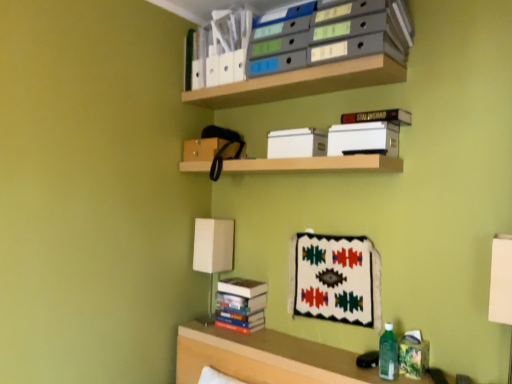
Question: Considering the positions of point (290, 147) and point (240, 56), is point (290, 147) closer or farther from the camera than point (240, 56)?

Choices:
 (A) closer
 (B) farther

Answer: (A)

Question: Is white matte paper at upper center, which is the first paperback book in left-to-right order, wider or thinner than white matte file folder at upper center, which ranks as the second book in bottom-to-top order?

Choices:
 (A) thin
 (B) wide

Answer: (A)

Question: Considering the real-world distances, which object is closest to the hardcover books at lower center, acting as the 2th book starting from the top?

Choices:
 (A) clear wood shelf at lower right, marked as the third shelf in a top-to-bottom arrangement
 (B) white matte file folder at upper center, which ranks as the second book in bottom-to-top order
 (C) wooden shelf at center, the 2th shelf in the bottom-to-top sequence
 (D) white fabric table lamp at left
 (E) hardcover book at upper center, which is the 1th paperback book from right to left

Answer: (A)

Question: Estimate the real-world distances between objects in this image. Which object is farther from the white matte file folder at upper center, which ranks as the second book in bottom-to-top order?

Choices:
 (A) wooden shelf at center, arranged as the 2th shelf when viewed from the top
 (B) hardcover books at lower center, acting as the 2th book starting from the top
 (C) clear wood shelf at lower right, the first shelf when ordered from bottom to top
 (D) hardcover book at upper center, acting as the 2th paperback book starting from the left
 (E) matte gray file folders at upper center, arranged as the third shelf when ordered from the bottom

Answer: (C)